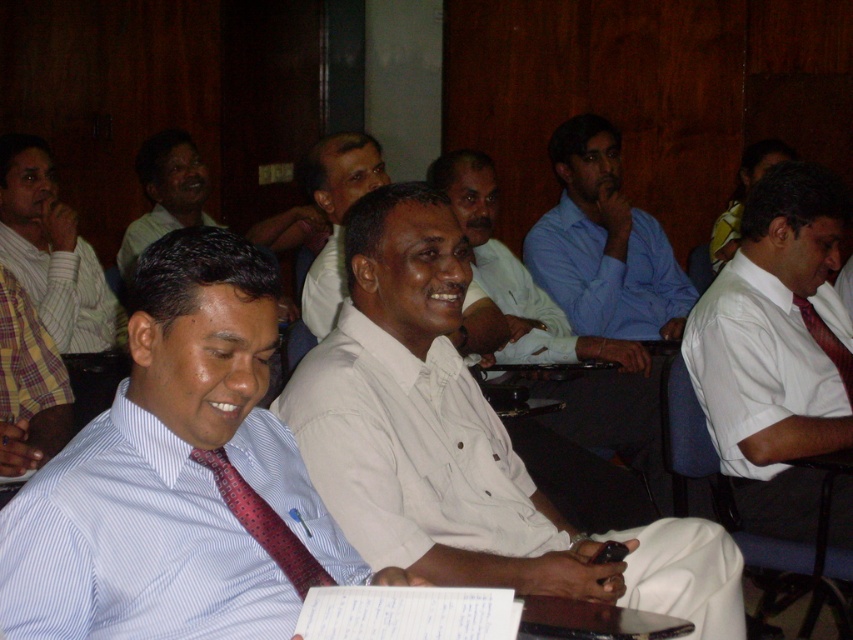
Who is more distant from viewer, (67, 634) or (47, 150)?

Point (47, 150)

Who is positioned more to the right, white striped shirt at center or striped cotton shirt at left?

From the viewer's perspective, white striped shirt at center appears more on the right side.

Between point (279, 600) and point (90, 259), which one is positioned in front?

Point (279, 600) is in front.

You are a GUI agent. You are given a task and a screenshot of the screen. Output one action in this format:
    pyautogui.click(x=<x>, y=<y>)
    Task: Click on the white striped shirt at center
    The image size is (853, 640).
    Given the screenshot: What is the action you would take?
    pyautogui.click(x=132, y=545)

Does white cotton shirt at center appear on the left side of blue shirt at center?

Yes, white cotton shirt at center is to the left of blue shirt at center.

Is point (647, 385) positioned after point (596, 280)?

No.

Where is `white cotton shirt at center`? This screenshot has width=853, height=640. white cotton shirt at center is located at coordinates (555, 336).

The image size is (853, 640). I want to click on striped cotton shirt at left, so click(x=59, y=273).

Between striped cotton shirt at left and red dotted tie at center, which one is positioned higher?

striped cotton shirt at left is above.

Image resolution: width=853 pixels, height=640 pixels. What do you see at coordinates (59, 273) in the screenshot? I see `striped cotton shirt at left` at bounding box center [59, 273].

You are a GUI agent. You are given a task and a screenshot of the screen. Output one action in this format:
    pyautogui.click(x=<x>, y=<y>)
    Task: Click on the striped cotton shirt at left
    The width and height of the screenshot is (853, 640).
    Given the screenshot: What is the action you would take?
    pyautogui.click(x=59, y=273)